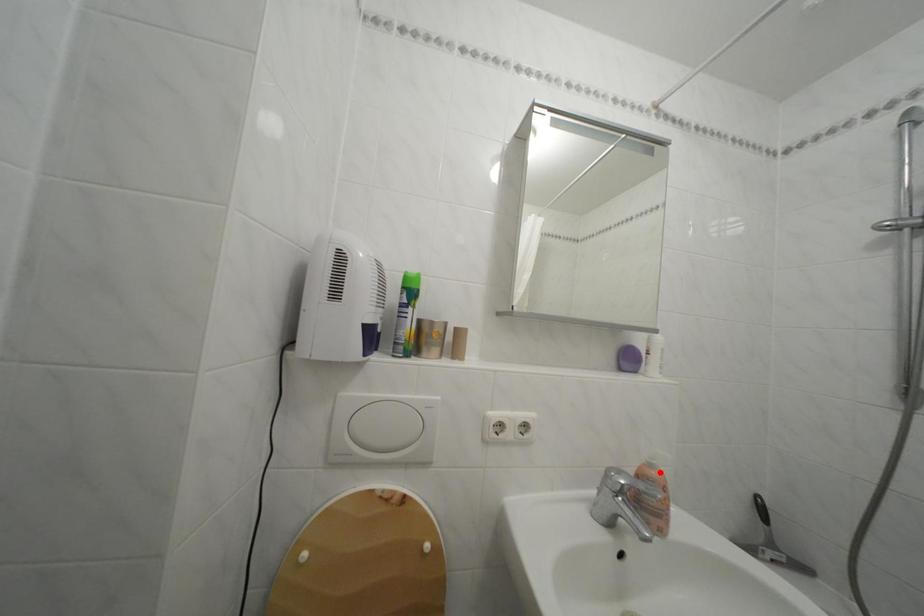
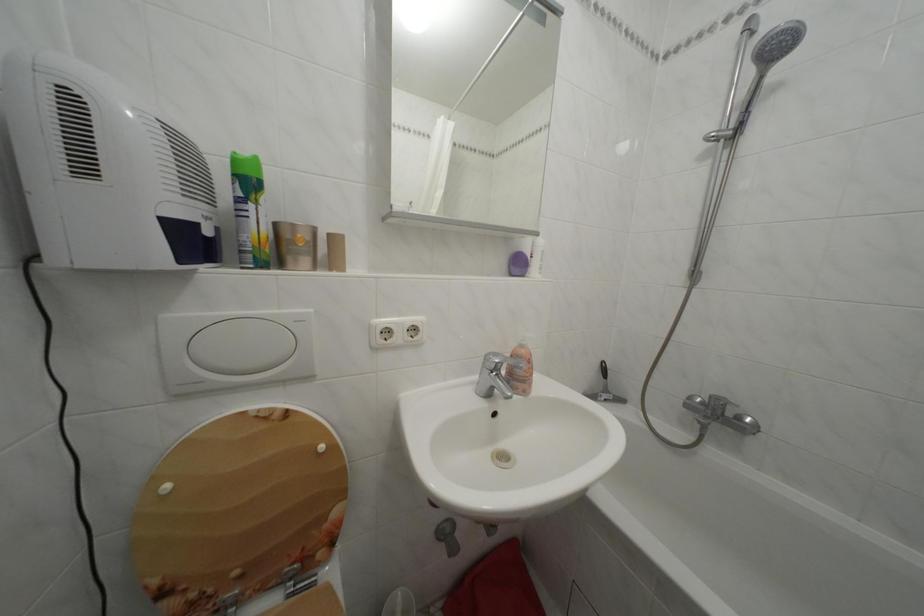
The point at the highlighted location is marked in the first image. Where is the corresponding point in the second image?

(530, 352)